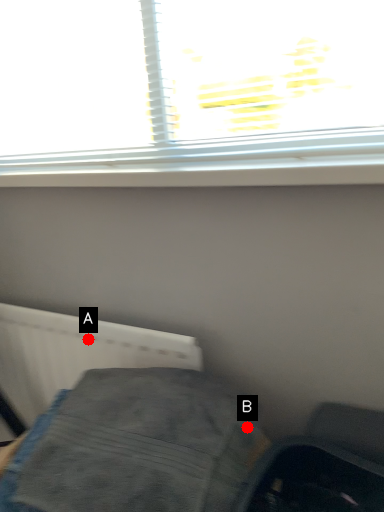
Question: Two points are circled on the image, labeled by A and B beside each circle. Among these points, which one is nearest to the camera?

Choices:
 (A) A is closer
 (B) B is closer

Answer: (B)